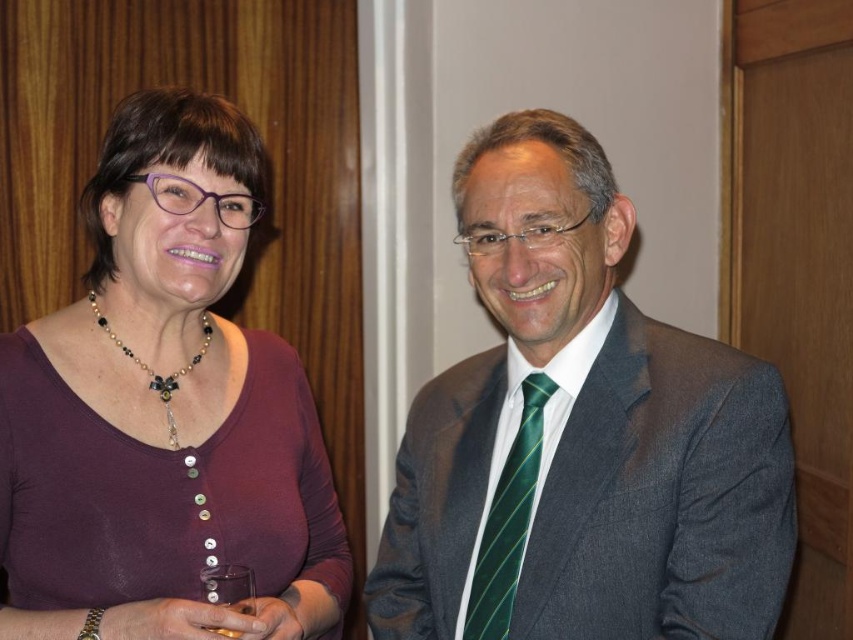
Question: Which of these objects is positioned farthest from the green striped tie at center?

Choices:
 (A) clear plastic cup at lower center
 (B) pearl and glass beads necklace at upper left
 (C) dark gray suit at center
 (D) clear glass at lower left

Answer: (B)

Question: Where is dark gray suit at center located in relation to green striped tie at center in the image?

Choices:
 (A) above
 (B) below

Answer: (A)

Question: Which point is closer to the camera?

Choices:
 (A) purple matte shirt at left
 (B) pearl and glass beads necklace at upper left
 (C) clear glass at lower left
 (D) clear plastic cup at lower center

Answer: (A)

Question: Can you confirm if purple matte shirt at left is bigger than clear plastic cup at lower center?

Choices:
 (A) yes
 (B) no

Answer: (A)

Question: From the image, what is the correct spatial relationship of dark gray suit at center in relation to green striped tie at center?

Choices:
 (A) left
 (B) right

Answer: (B)

Question: Which of the following is the closest to the observer?

Choices:
 (A) (194, 365)
 (B) (523, 408)
 (C) (395, 483)

Answer: (B)